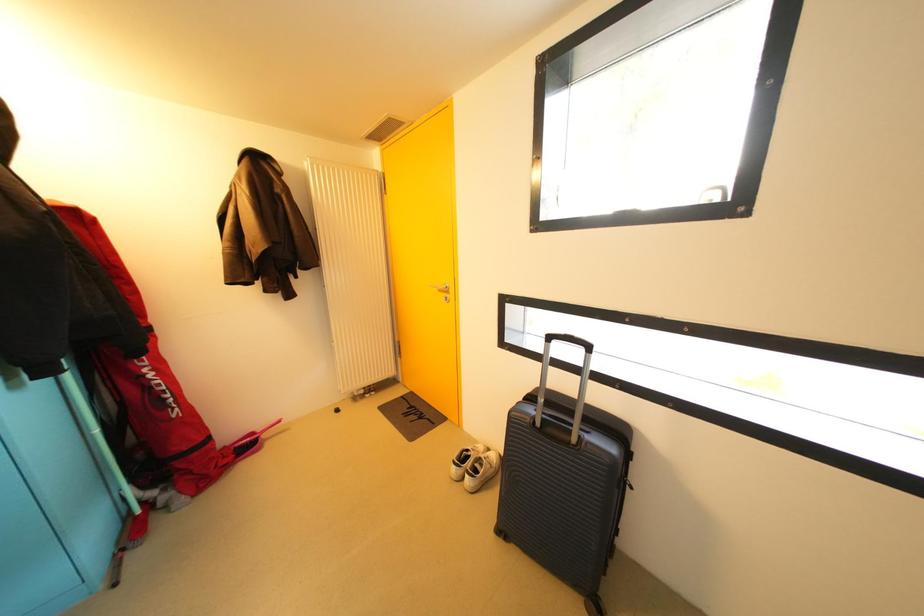
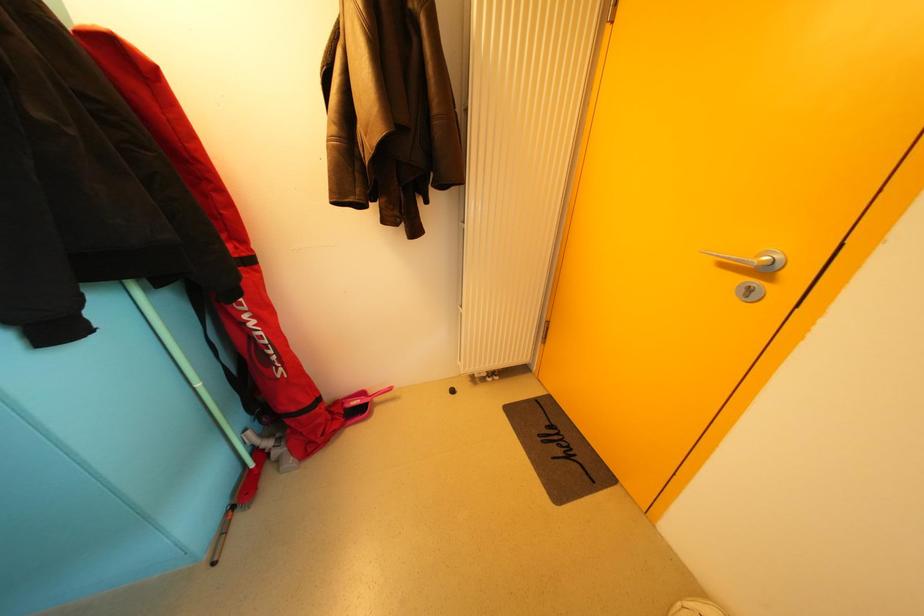
The images are taken continuously from a first-person perspective. In which direction is your viewpoint rotating?

The camera rotated toward left-down.